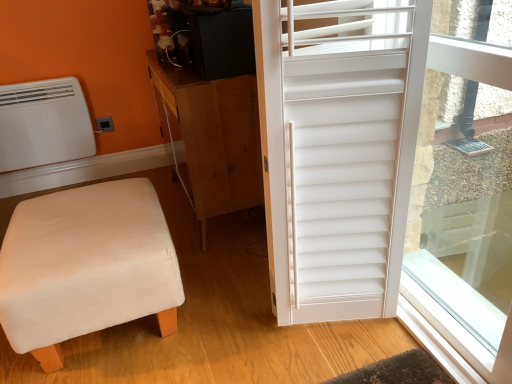
The image size is (512, 384). Find the location of `free location to the left of white matte shutter at right`. free location to the left of white matte shutter at right is located at coordinates (231, 321).